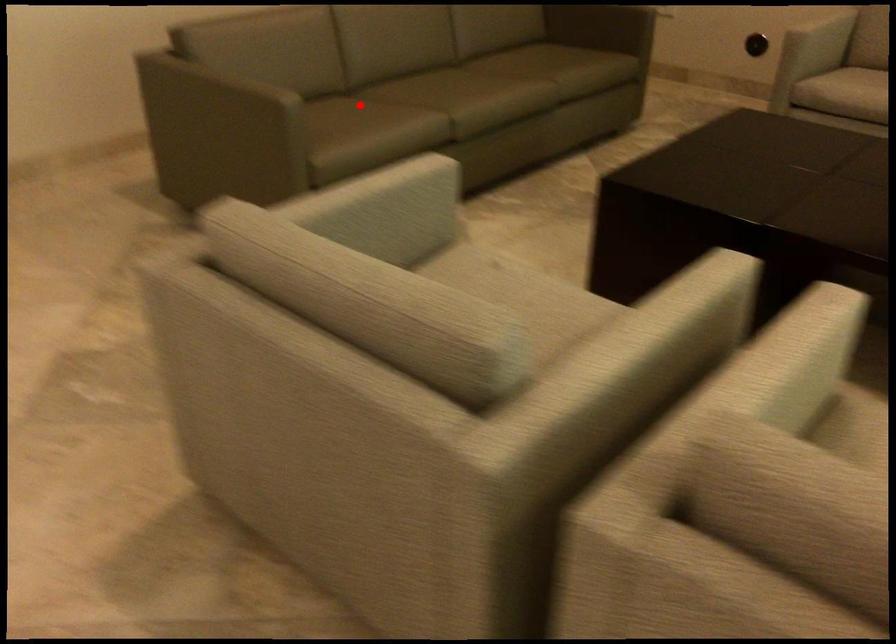
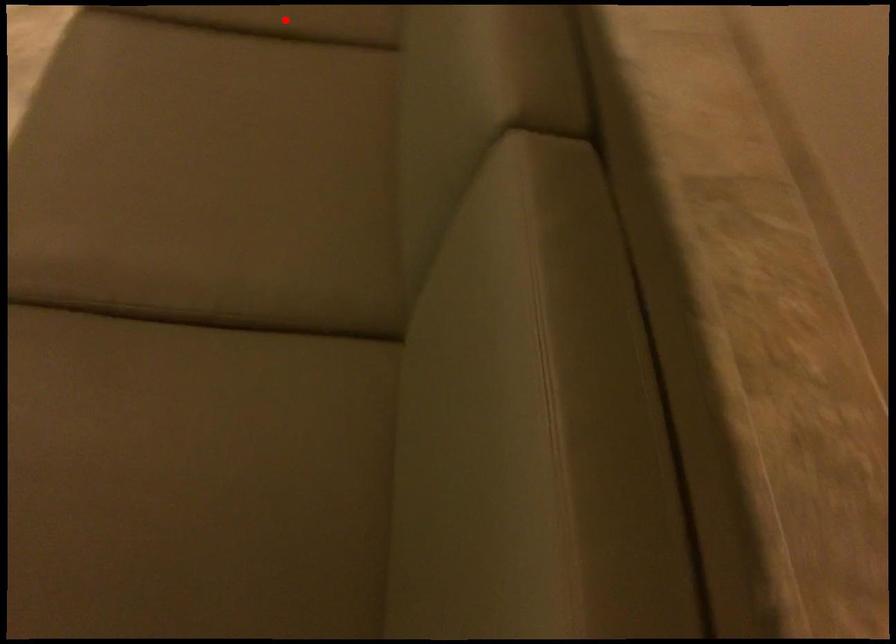
I am providing you with two images of the same scene from different viewpoints. A red point is marked on the first image and another point is marked on the second image. Does the point marked in image1 correspond to the same location as the one in image2?

Yes